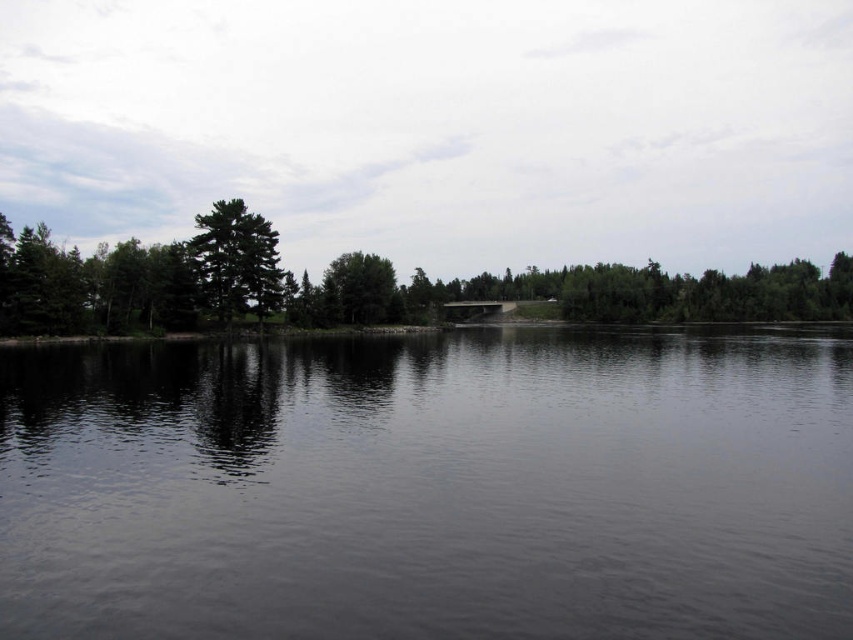
You are standing on the shore of the serene natural landscape and want to compare the heights of the objects in the scene. Which object, the dark reflective water at center or the green matte tree at left, is taller?

The green matte tree at left is taller than the dark reflective water at center, as stated in the description.

You are standing on the shoreline lined with dense greenery on the left side of the image. You want to walk to the dark reflective water at center. Which direction should you head towards?

The dark reflective water at center is located at point (428, 488), so you should head towards the center of the image from the left shoreline.